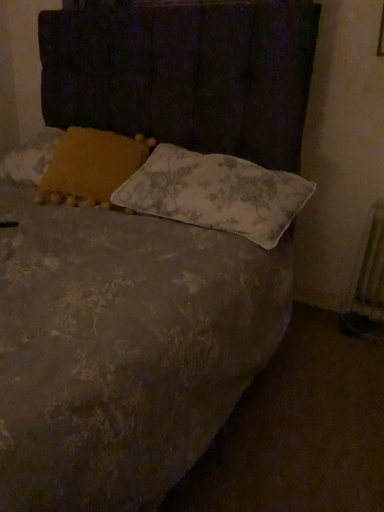
Question: Is yellow fabric pillow at upper left, the 2th pillow when ordered from right to left, not inside metallic silver radiator at right?

Choices:
 (A) yes
 (B) no

Answer: (A)

Question: From a real-world perspective, is yellow fabric pillow at upper left, the 1th pillow positioned from the left, physically below metallic silver radiator at right?

Choices:
 (A) no
 (B) yes

Answer: (A)

Question: Is yellow fabric pillow at upper left, the 2th pillow when ordered from right to left, smaller than metallic silver radiator at right?

Choices:
 (A) no
 (B) yes

Answer: (A)

Question: Is yellow fabric pillow at upper left, the 2th pillow when ordered from right to left, at the left side of metallic silver radiator at right?

Choices:
 (A) yes
 (B) no

Answer: (A)

Question: Can you confirm if yellow fabric pillow at upper left, the 2th pillow when ordered from right to left, is thinner than metallic silver radiator at right?

Choices:
 (A) no
 (B) yes

Answer: (A)

Question: From the image's perspective, is yellow fabric pillow at upper left, the 2th pillow when ordered from right to left, under metallic silver radiator at right?

Choices:
 (A) no
 (B) yes

Answer: (A)

Question: Considering the relative sizes of metallic silver radiator at right and floral-patterned fabric pillow at center, which appears as the first pillow when viewed from the right, in the image provided, is metallic silver radiator at right shorter than floral-patterned fabric pillow at center, which appears as the first pillow when viewed from the right,?

Choices:
 (A) yes
 (B) no

Answer: (B)

Question: Does metallic silver radiator at right have a greater height compared to floral-patterned fabric pillow at center, which appears as the first pillow when viewed from the right?

Choices:
 (A) no
 (B) yes

Answer: (B)

Question: Is metallic silver radiator at right to the right of floral-patterned fabric pillow at center, which appears as the first pillow when viewed from the right, from the viewer's perspective?

Choices:
 (A) no
 (B) yes

Answer: (B)

Question: Can you confirm if metallic silver radiator at right is wider than floral-patterned fabric pillow at center, which appears as the first pillow when viewed from the right?

Choices:
 (A) no
 (B) yes

Answer: (A)

Question: From a real-world perspective, is metallic silver radiator at right located higher than floral-patterned fabric pillow at center, which is the 2th pillow from left to right?

Choices:
 (A) yes
 (B) no

Answer: (B)

Question: Would you consider metallic silver radiator at right to be distant from floral-patterned fabric pillow at center, which is the 2th pillow from left to right?

Choices:
 (A) no
 (B) yes

Answer: (A)

Question: Considering the relative positions of floral-patterned fabric pillow at center, which is the 2th pillow from left to right, and metallic silver radiator at right in the image provided, is floral-patterned fabric pillow at center, which is the 2th pillow from left to right, to the left of metallic silver radiator at right from the viewer's perspective?

Choices:
 (A) yes
 (B) no

Answer: (A)